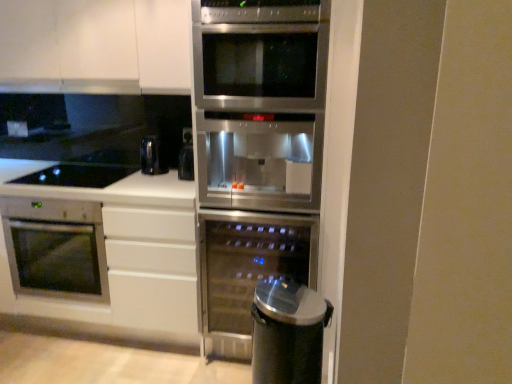
Question: Is white matte countertop at lower left to the left or to the right of satin silver exhaust hood at upper center in the image?

Choices:
 (A) right
 (B) left

Answer: (B)

Question: Is point (192, 223) positioned closer to the camera than point (14, 87)?

Choices:
 (A) farther
 (B) closer

Answer: (B)

Question: Considering the real-world distances, which object is closest to the satin stainless steel wine cooler at center, the 2th oven from the left?

Choices:
 (A) stainless steel fridge at center
 (B) sleek metallic trash can at lower right
 (C) satin silver exhaust hood at upper center
 (D) satin silver oven at lower left, which is the 2th oven in right-to-left order
 (E) white matte cabinet at upper left

Answer: (A)

Question: Based on their relative distances, which object is nearer to the satin stainless steel wine cooler at center, the 2th oven from the left?

Choices:
 (A) satin silver exhaust hood at upper center
 (B) white matte countertop at lower left
 (C) black glass cooktop at lower left
 (D) sleek metallic trash can at lower right
 (E) satin silver oven at lower left, which is the 2th oven in right-to-left order

Answer: (D)